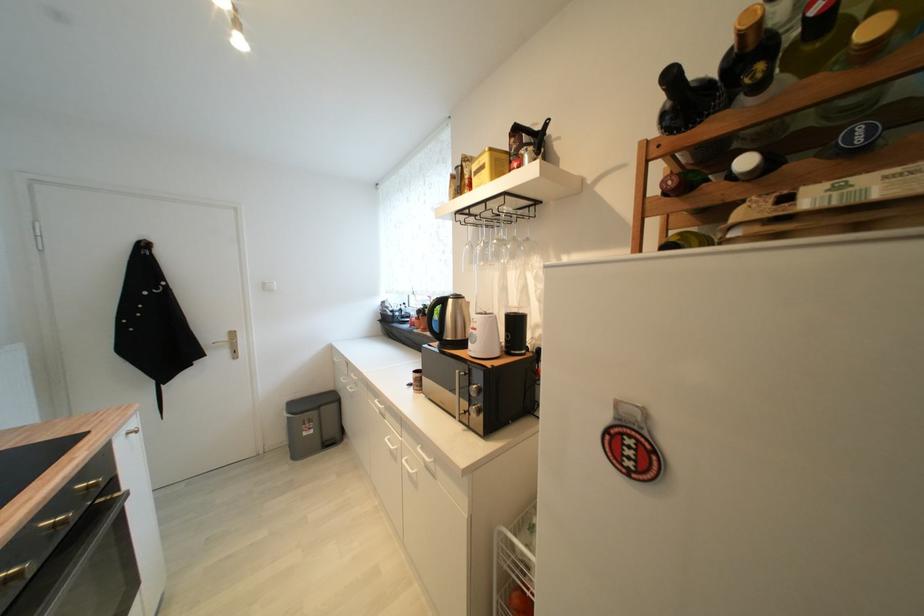
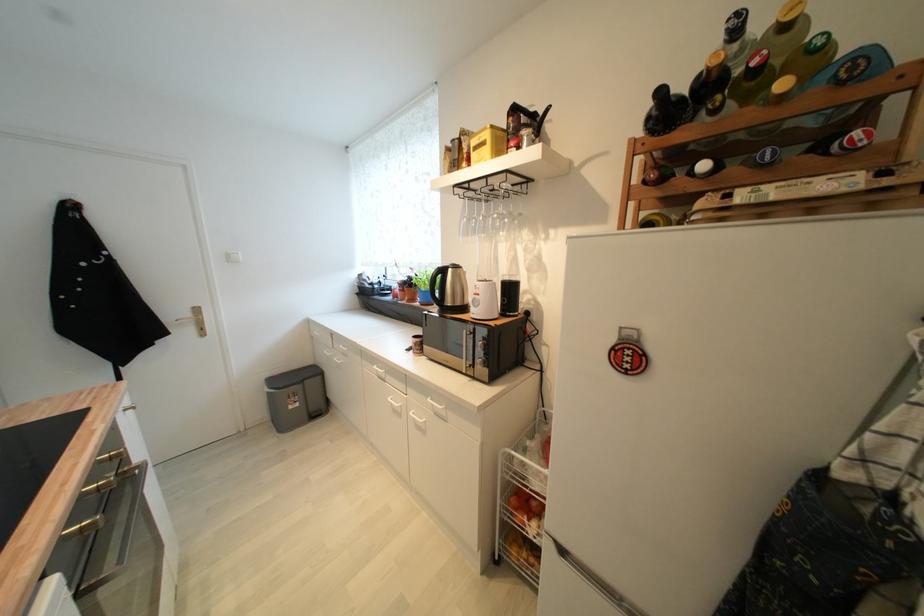
Locate, in the second image, the point that corresponds to point 480,331 in the first image.

(483, 296)